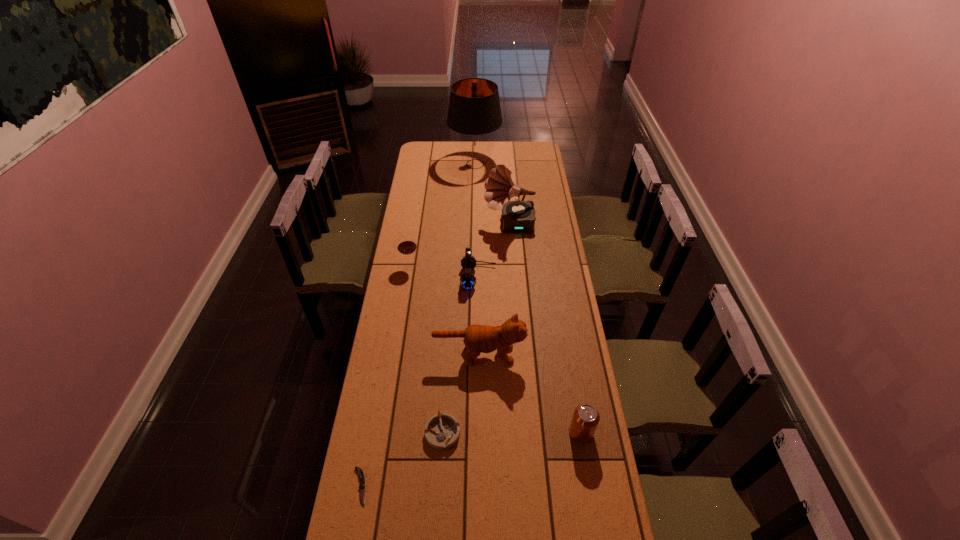
Image resolution: width=960 pixels, height=540 pixels. I want to click on vacant space at the far left corner of the desktop, so click(x=422, y=153).

Identify the location of vacant region at the far right corner of the desktop. (542, 152).

Locate an element on the screen. The height and width of the screenshot is (540, 960). vacant point located between the wineglass and the second shortest object is located at coordinates (426, 349).

I want to click on unoccupied position between the seventh tallest object and the rightmost object, so click(512, 432).

The image size is (960, 540). In order to click on free space between the headset and the wineglass in this screenshot , I will do `click(444, 272)`.

Find the location of `free space between the lampshade and the ashtray`. free space between the lampshade and the ashtray is located at coordinates (459, 298).

The image size is (960, 540). What are the coordinates of `free space that is in between the cat and the wineglass` in the screenshot? It's located at (444, 310).

Locate an element on the screen. The height and width of the screenshot is (540, 960). vacant area between the wineglass and the lampshade is located at coordinates (443, 215).

Identify the location of vacant space that is in between the nearest object and the wineglass. This screenshot has width=960, height=540. (385, 376).

In order to click on empty location between the wineglass and the pocketknife in this screenshot , I will do `click(385, 376)`.